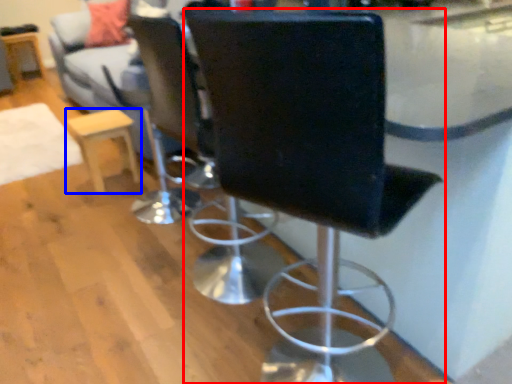
Question: Which object appears farthest to the camera in this image, chair (highlighted by a red box) or furniture (highlighted by a blue box)?

Choices:
 (A) chair
 (B) furniture

Answer: (B)